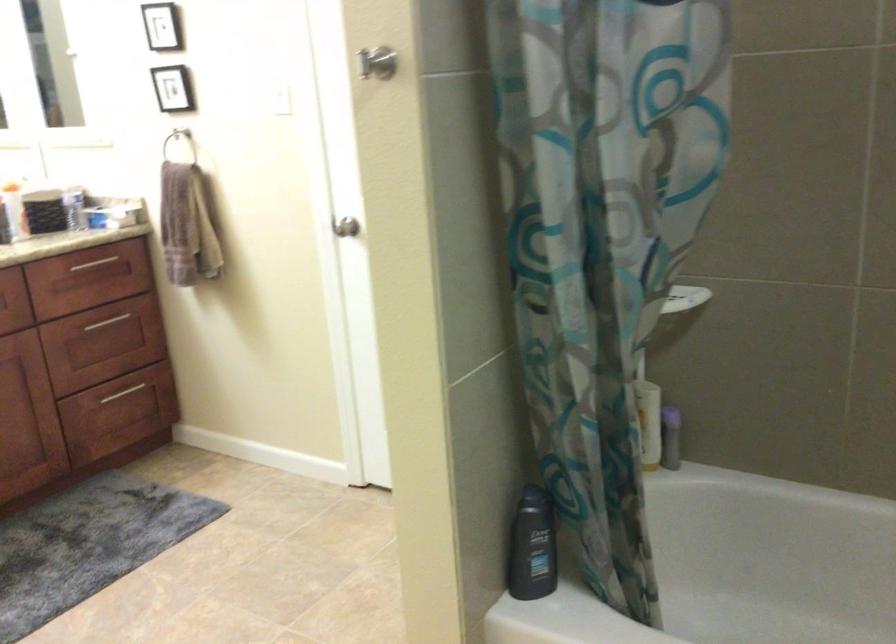
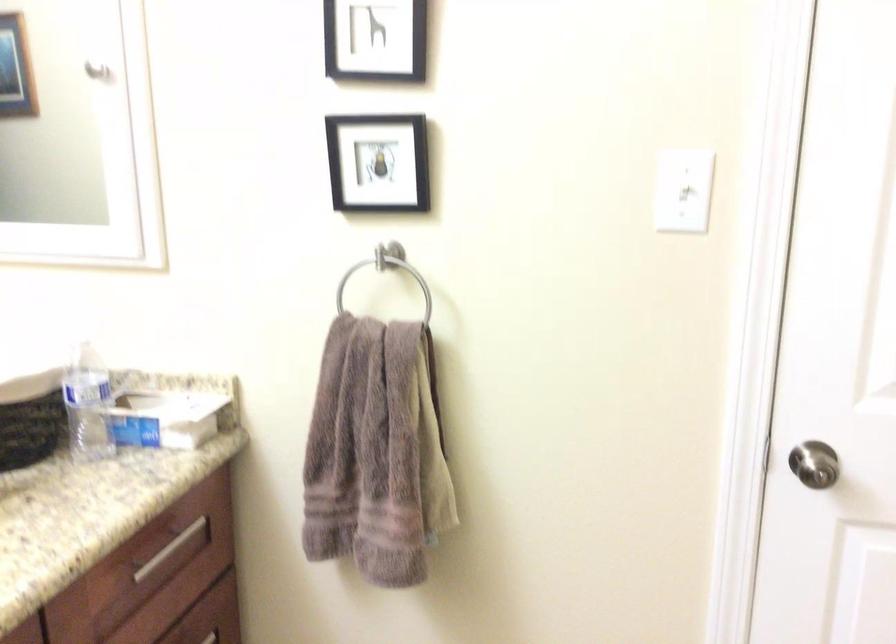
In the second image, find the point that corresponds to point 182,221 in the first image.

(375, 453)